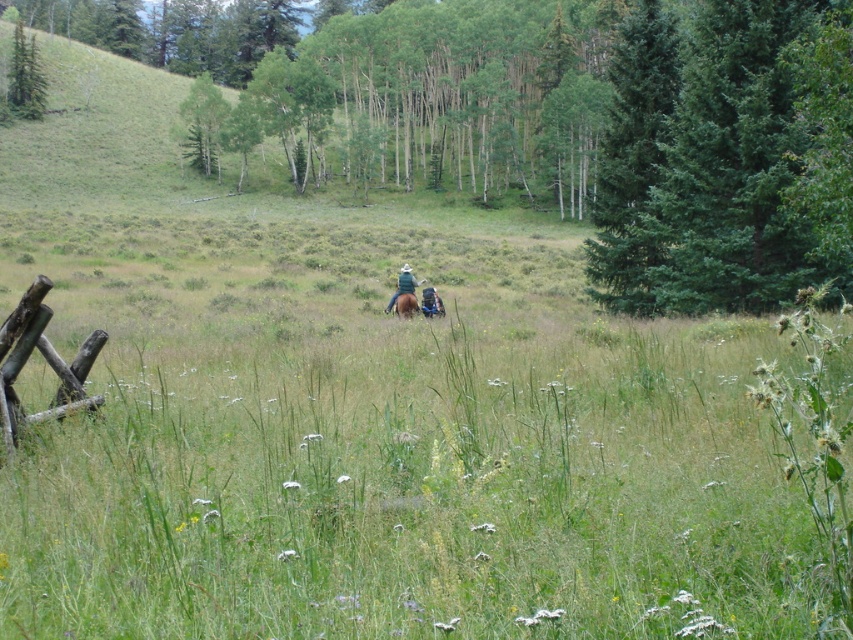
Does green evergreen tree at upper right appear on the left side of green matte tree at upper left?

No, green evergreen tree at upper right is not to the left of green matte tree at upper left.

Does point (787, 168) lie in front of point (30, 104)?

Yes, point (787, 168) is closer to viewer.

Is point (694, 48) closer to camera compared to point (18, 45)?

Yes, it is in front of point (18, 45).

You are a GUI agent. You are given a task and a screenshot of the screen. Output one action in this format:
    pyautogui.click(x=<x>, y=<y>)
    Task: Click on the green evergreen tree at upper right
    The height and width of the screenshot is (640, 853).
    Given the screenshot: What is the action you would take?
    pyautogui.click(x=701, y=163)

Is green grassy field at center shorter than green evergreen tree at upper right?

Indeed, green grassy field at center has a lesser height compared to green evergreen tree at upper right.

Which is more to the right, green grassy field at center or green evergreen tree at upper right?

green evergreen tree at upper right is more to the right.

What do you see at coordinates (425, 493) in the screenshot? The image size is (853, 640). I see `green grassy field at center` at bounding box center [425, 493].

Find the location of a particular element. This screenshot has width=853, height=640. green grassy field at center is located at coordinates (425, 493).

Is green evergreen tree at upper right below brown wooden fence at lower left?

No, green evergreen tree at upper right is not below brown wooden fence at lower left.

Between point (792, 282) and point (0, 412), which one is positioned behind?

The point (792, 282) is more distant.

At what (x,y) coordinates should I click in order to perform the action: click on green evergreen tree at upper right. Please return your answer as a coordinate pair (x, y). Looking at the image, I should click on (701, 163).